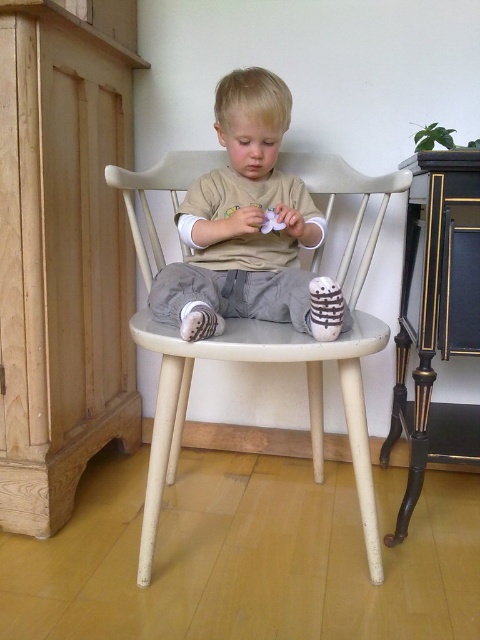
Who is shorter, white painted wood chair at center or white matte plush toy at center?

Standing shorter between the two is white matte plush toy at center.

Which is more to the left, white painted wood chair at center or white matte plush toy at center?

Positioned to the left is white painted wood chair at center.

Which is behind, point (238, 348) or point (263, 225)?

The point (263, 225) is more distant.

Identify the location of white painted wood chair at center. The width and height of the screenshot is (480, 640). (278, 360).

Is the position of matte beige shirt at center more distant than that of white striped socks at lower center?

Yes, matte beige shirt at center is behind white striped socks at lower center.

Between matte beige shirt at center and white striped socks at lower center, which one has more height?

matte beige shirt at center

This screenshot has width=480, height=640. In order to click on matte beige shirt at center in this screenshot , I will do `click(241, 221)`.

At what (x,y) coordinates should I click in order to perform the action: click on matte beige shirt at center. Please return your answer as a coordinate pair (x, y). This screenshot has width=480, height=640. Looking at the image, I should click on (241, 221).

Does matte beige shirt at center appear over white matte plush toy at center?

Correct, matte beige shirt at center is located above white matte plush toy at center.

Who is more forward, (315, 243) or (264, 216)?

Point (264, 216) is more forward.

At what (x,y) coordinates should I click in order to perform the action: click on matte beige shirt at center. Please return your answer as a coordinate pair (x, y). The image size is (480, 640). Looking at the image, I should click on (241, 221).